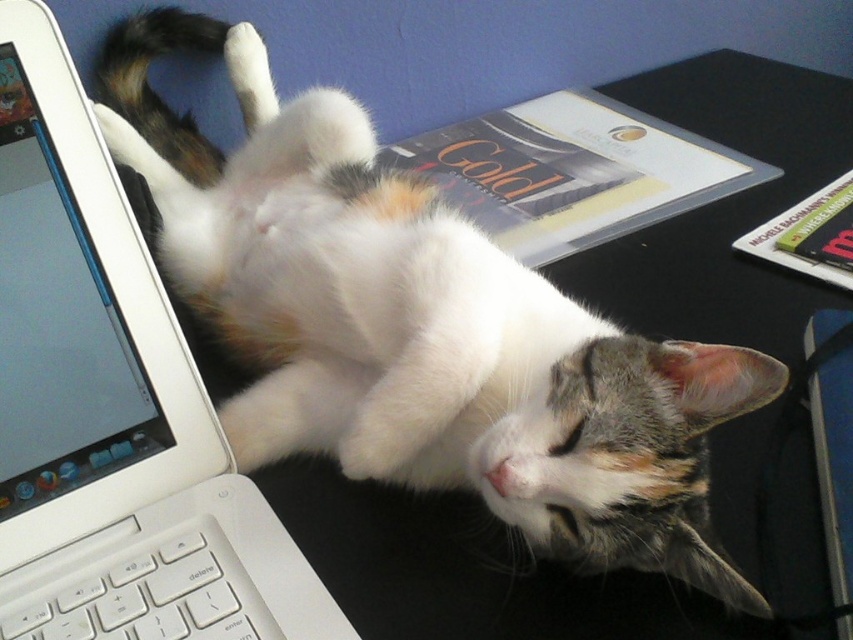
Question: Among these points, which one is farthest from the camera?

Choices:
 (A) (131, 547)
 (B) (99, 576)

Answer: (A)

Question: Which point is farther from the camera taking this photo?

Choices:
 (A) (543, 118)
 (B) (273, 513)

Answer: (A)

Question: Can you confirm if gold paper folder at upper center is wider than white plastic keyboard at lower left?

Choices:
 (A) yes
 (B) no

Answer: (A)

Question: In this image, where is white plastic laptop at left located relative to white plastic keyboard at lower left?

Choices:
 (A) below
 (B) above

Answer: (B)

Question: Which object is positioned closest to the white plastic laptop at left?

Choices:
 (A) gold paper folder at upper center
 (B) white plastic keyboard at lower left

Answer: (B)

Question: Does gold paper folder at upper center appear under white plastic keyboard at lower left?

Choices:
 (A) yes
 (B) no

Answer: (B)